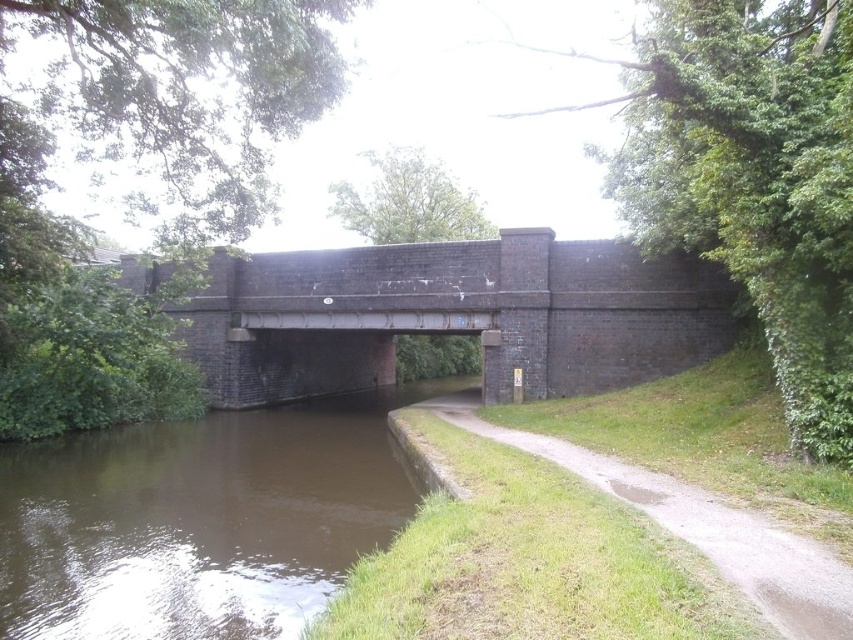
Question: In this image, where is brown murky water at lower left located relative to green grassy path at lower center?

Choices:
 (A) below
 (B) above

Answer: (A)

Question: Observing the image, what is the correct spatial positioning of brown murky water at lower left in reference to brown brick bridge at center?

Choices:
 (A) below
 (B) above

Answer: (A)

Question: Considering the relative positions of brown murky water at lower left and green grassy path at lower center in the image provided, where is brown murky water at lower left located with respect to green grassy path at lower center?

Choices:
 (A) below
 (B) above

Answer: (A)

Question: Which of the following is the closest to the observer?

Choices:
 (A) brown murky water at lower left
 (B) green grassy path at lower center
 (C) brown brick bridge at center

Answer: (B)

Question: Among these points, which one is farthest from the camera?

Choices:
 (A) (792, 584)
 (B) (9, 449)
 (C) (244, 282)

Answer: (C)

Question: Which object is farther from the camera taking this photo?

Choices:
 (A) brown brick bridge at center
 (B) green grassy path at lower center
 (C) brown murky water at lower left

Answer: (A)